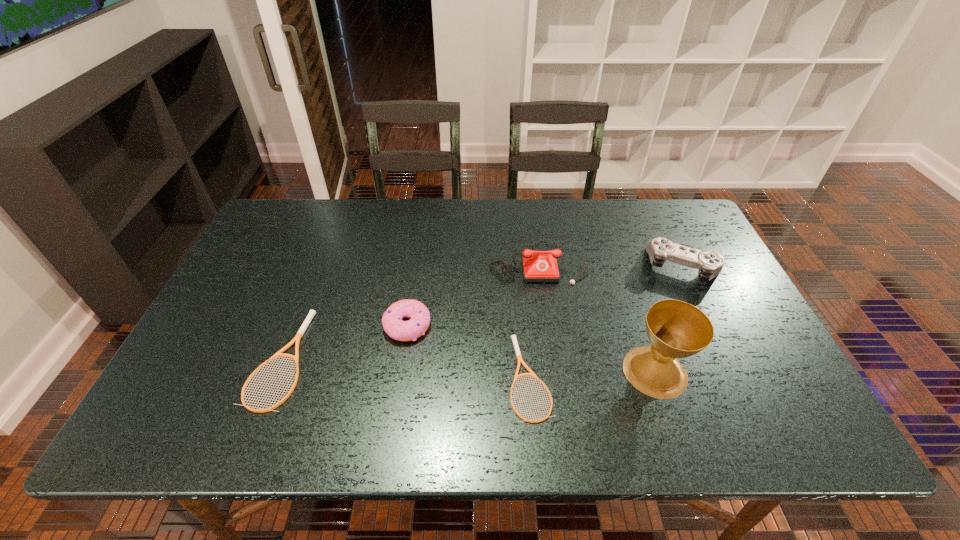
Identify the location of the fifth tallest object. (311, 314).

I want to click on the taller tennis racket, so click(311, 314).

The image size is (960, 540). I want to click on the right tennis racket, so 513,337.

The image size is (960, 540). In order to click on the shorter tennis racket in this screenshot , I will do `click(513, 337)`.

Image resolution: width=960 pixels, height=540 pixels. Identify the location of telephone. (541, 267).

Identify the location of doughnut. (393, 325).

Locate an element on the screen. This screenshot has width=960, height=540. the second object from left to right is located at coordinates (x=393, y=325).

You are a GUI agent. You are given a task and a screenshot of the screen. Output one action in this format:
    pyautogui.click(x=<x>, y=<y>)
    Task: Click on the control
    
    Given the screenshot: What is the action you would take?
    pyautogui.click(x=709, y=264)

The image size is (960, 540). I want to click on the fifth object from left to right, so (676, 329).

The width and height of the screenshot is (960, 540). Find the location of `the tallest object`. the tallest object is located at coordinates (676, 329).